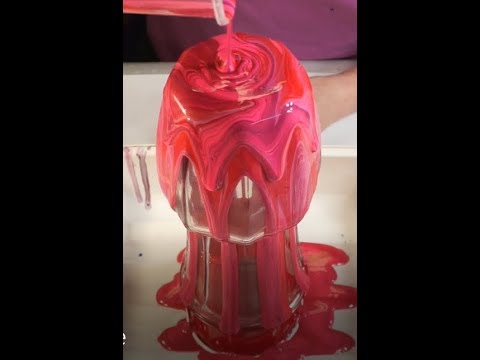
Find the location of a particular element. This screenshot has width=480, height=360. cup of red goo is located at coordinates click(x=210, y=12).